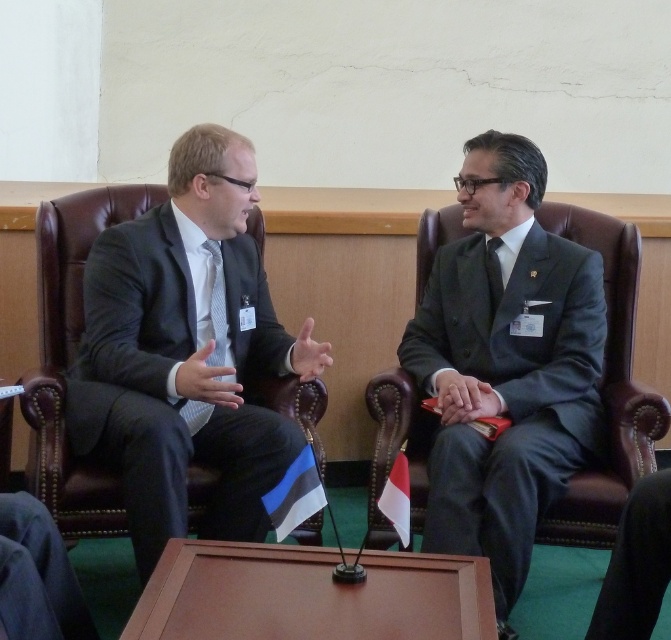
Does gray matte suit at right appear over blue and white striped flag at lower center?

Yes.

Is gray matte suit at right wider than blue and white striped flag at lower center?

Yes, gray matte suit at right is wider than blue and white striped flag at lower center.

Does point (582, 403) come in front of point (309, 474)?

No, (582, 403) is further to viewer.

Locate an element on the screen. gray matte suit at right is located at coordinates (507, 365).

Does point (519, 216) come farther from viewer compared to point (203, 328)?

Yes.

Between gray matte suit at right and striped fabric tie at left, which one has more height?

Standing taller between the two is gray matte suit at right.

At what (x,y) coordinates should I click in order to perform the action: click on gray matte suit at right. Please return your answer as a coordinate pair (x, y). Image resolution: width=671 pixels, height=640 pixels. Looking at the image, I should click on (507, 365).

Does matte black suit at left appear on the left side of striped fabric tie at left?

Yes, matte black suit at left is to the left of striped fabric tie at left.

Describe the element at coordinates (187, 353) in the screenshot. I see `matte black suit at left` at that location.

The image size is (671, 640). Identify the location of matte black suit at left. (187, 353).